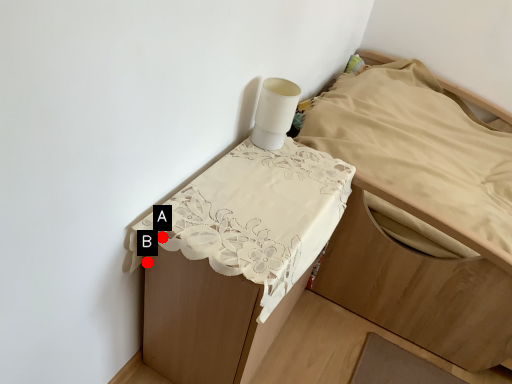
Question: Two points are circled on the image, labeled by A and B beside each circle. Which point is closer to the camera?

Choices:
 (A) A is closer
 (B) B is closer

Answer: (A)